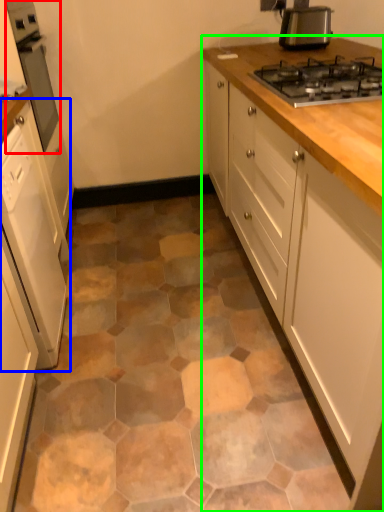
Question: Which object is positioned farthest from home appliance (highlighted by a red box)? Select from cabinetry (highlighted by a blue box) and cabinetry (highlighted by a green box).

Choices:
 (A) cabinetry
 (B) cabinetry

Answer: (B)